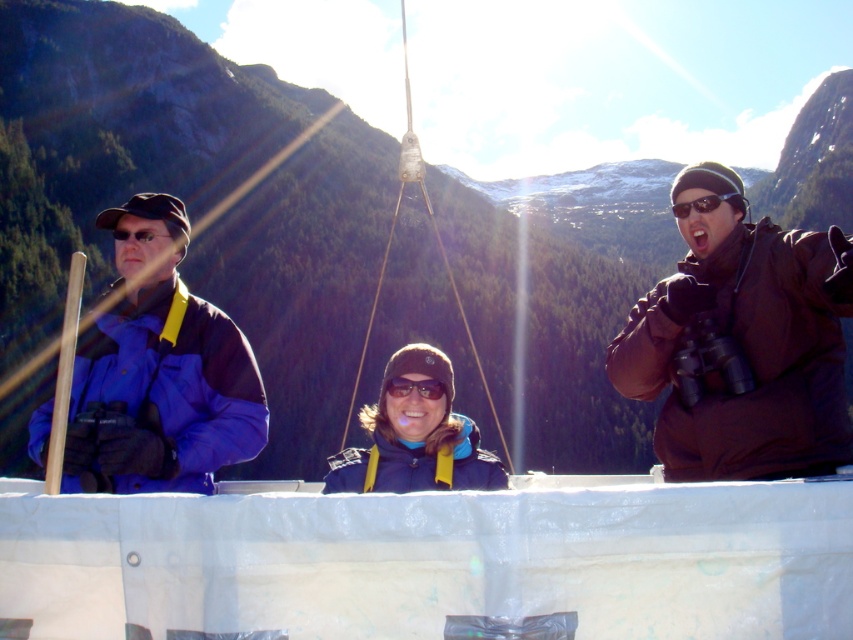
Question: Is brown matte jacket at right further to the viewer compared to black matte sunglasses at upper right?

Choices:
 (A) yes
 (B) no

Answer: (B)

Question: Can you confirm if blue fleece jacket at left is wider than purple matte goggles at center?

Choices:
 (A) no
 (B) yes

Answer: (B)

Question: Which of these objects is positioned closest to the black matte sunglasses at upper right?

Choices:
 (A) blue fleece jacket at center
 (B) brown matte jacket at right
 (C) blue fleece jacket at left

Answer: (B)

Question: Does brown matte jacket at right lie behind black matte sunglasses at upper right?

Choices:
 (A) yes
 (B) no

Answer: (B)

Question: Which object is farther from the camera taking this photo?

Choices:
 (A) blue fleece jacket at center
 (B) purple matte goggles at center
 (C) brown matte jacket at right

Answer: (B)

Question: Which point appears closest to the camera in this image?

Choices:
 (A) (775, 262)
 (B) (691, 419)
 (C) (428, 458)

Answer: (A)